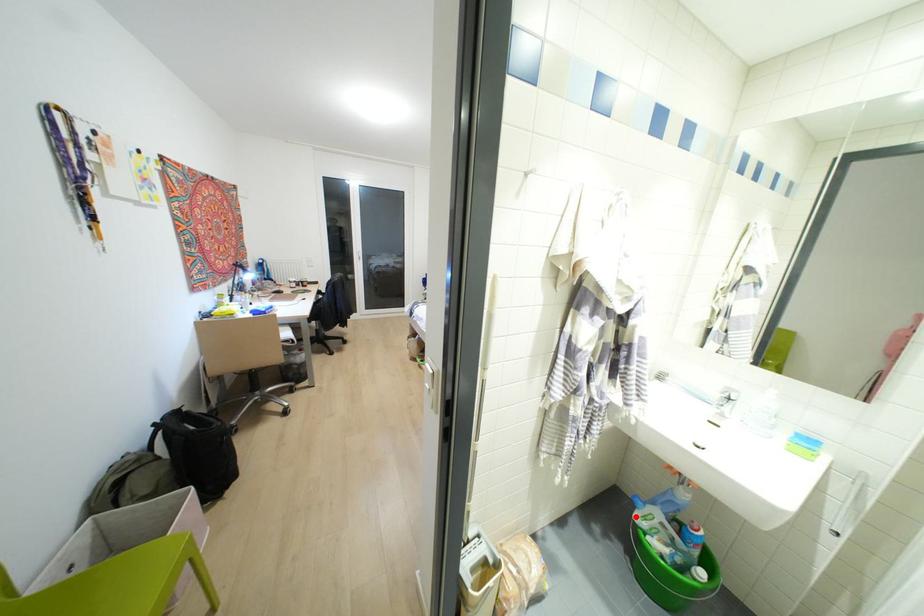
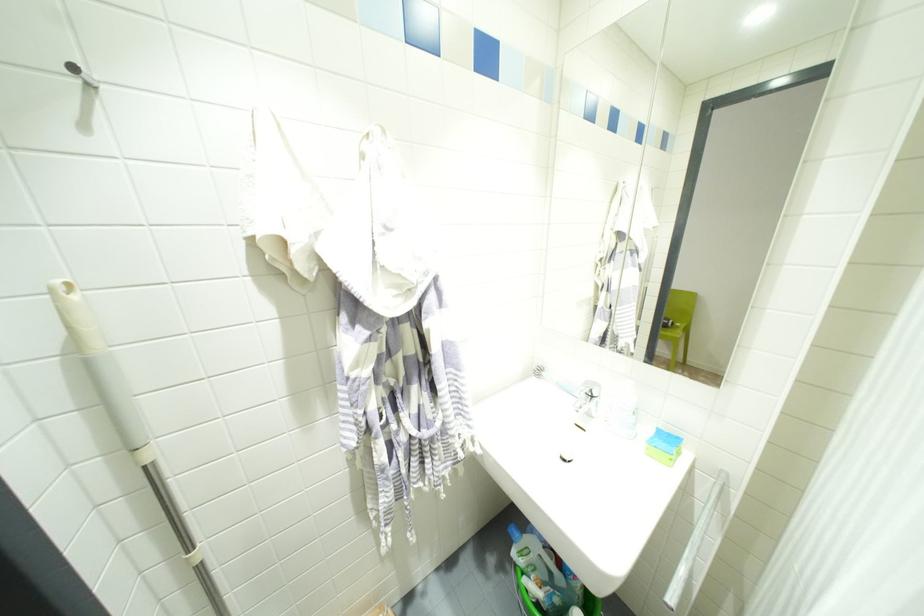
Locate, in the second image, the point that corresponds to the highlighted location in the first image.

(513, 553)